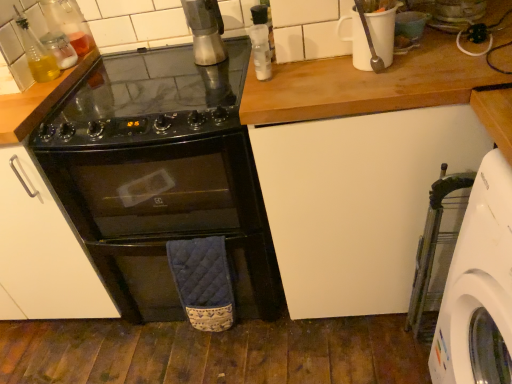
Describe the element at coordinates (205, 31) in the screenshot. I see `metallic silver grinder at upper center` at that location.

Describe the element at coordinates (356, 202) in the screenshot. I see `white matte cabinet at center` at that location.

What is the approximate width of black glass gas stove at center?

63.66 centimeters.

I want to click on transparent plastic bottle at upper center, acting as the third bottle starting from the left, so click(x=260, y=42).

This screenshot has width=512, height=384. Describe the element at coordinates (435, 252) in the screenshot. I see `white plastic washing machine at lower right` at that location.

Where is `metallic silver grinder at upper center`? This screenshot has height=384, width=512. metallic silver grinder at upper center is located at coordinates (205, 31).

Looking at this image, from the image's perspective, is white matte cabinet at center below metallic silver grinder at upper center?

Yes.

Based on the photo, do you think white matte cabinet at center is within metallic silver grinder at upper center, or outside of it?

white matte cabinet at center lies outside metallic silver grinder at upper center.

Which of these two, white matte cabinet at center or metallic silver grinder at upper center, is wider?

With larger width is white matte cabinet at center.

Considering the relative sizes of white matte cabinet at center and transparent plastic bottle at upper center, acting as the third bottle starting from the left, in the image provided, is white matte cabinet at center taller than transparent plastic bottle at upper center, acting as the third bottle starting from the left,?

Indeed, white matte cabinet at center has a greater height compared to transparent plastic bottle at upper center, acting as the third bottle starting from the left.

Is white matte cabinet at center directly adjacent to transparent plastic bottle at upper center, arranged as the first bottle when viewed from the right?

white matte cabinet at center is not next to transparent plastic bottle at upper center, arranged as the first bottle when viewed from the right, and they're not touching.

Is white matte cabinet at center oriented away from transparent plastic bottle at upper center, acting as the third bottle starting from the left?

That's not correct — white matte cabinet at center is not looking away from transparent plastic bottle at upper center, acting as the third bottle starting from the left.

Could you measure the distance between white matte cabinet at center and transparent plastic bottle at upper center, arranged as the first bottle when viewed from the right?

The distance of white matte cabinet at center from transparent plastic bottle at upper center, arranged as the first bottle when viewed from the right, is 17.35 inches.

Between black glass gas stove at center and white plastic washing machine at lower right, which one has more height?

Standing taller between the two is white plastic washing machine at lower right.

Consider the image. Is black glass gas stove at center facing away from white plastic washing machine at lower right?

black glass gas stove at center is not turned away from white plastic washing machine at lower right.

Is black glass gas stove at center next to white plastic washing machine at lower right?

No, black glass gas stove at center is not with white plastic washing machine at lower right.

Is point (63, 48) farther from viewer compared to point (15, 17)?

Yes, it is behind point (15, 17).

Is translucent glass bottle at upper left, positioned as the second bottle in left-to-right order, placed right next to translucent glass bottle at upper left, marked as the first bottle in a left-to-right arrangement?

Yes.

Consider the image. Considering the sizes of translucent glass bottle at upper left, positioned as the 2th bottle in right-to-left order, and translucent glass bottle at upper left, marked as the first bottle in a left-to-right arrangement, in the image, is translucent glass bottle at upper left, positioned as the 2th bottle in right-to-left order, wider or thinner than translucent glass bottle at upper left, marked as the first bottle in a left-to-right arrangement,?

Considering their sizes, translucent glass bottle at upper left, positioned as the 2th bottle in right-to-left order, looks broader than translucent glass bottle at upper left, marked as the first bottle in a left-to-right arrangement.

Which bottle is the 1st one when counting from the front of the translucent glass bottle at upper left, positioned as the second bottle in left-to-right order? Please provide its 2D coordinates.

[(36, 52)]

Considering the relative sizes of translucent glass bottle at upper left, the 3th bottle from the right, and white matte cabinet at center in the image provided, is translucent glass bottle at upper left, the 3th bottle from the right, wider than white matte cabinet at center?

Incorrect, the width of translucent glass bottle at upper left, the 3th bottle from the right, does not surpass that of white matte cabinet at center.

How far apart are translucent glass bottle at upper left, the 3th bottle from the right, and white matte cabinet at center?

1.01 meters.

Does point (26, 21) come farther from viewer compared to point (362, 175)?

Yes, it is.

Considering the positions of objects translucent glass bottle at upper left, marked as the first bottle in a left-to-right arrangement, and white matte cabinet at center in the image provided, who is more to the right, translucent glass bottle at upper left, marked as the first bottle in a left-to-right arrangement, or white matte cabinet at center?

white matte cabinet at center is more to the right.

Does point (433, 238) come in front of point (195, 27)?

Yes, point (433, 238) is in front of point (195, 27).

Considering the relative sizes of white plastic washing machine at lower right and metallic silver grinder at upper center in the image provided, is white plastic washing machine at lower right thinner than metallic silver grinder at upper center?

In fact, white plastic washing machine at lower right might be wider than metallic silver grinder at upper center.

Which is more to the left, white plastic washing machine at lower right or metallic silver grinder at upper center?

From the viewer's perspective, metallic silver grinder at upper center appears more on the left side.

Considering the relative sizes of black glass gas stove at center and translucent glass bottle at upper left, the 3th bottle from the right, in the image provided, is black glass gas stove at center bigger than translucent glass bottle at upper left, the 3th bottle from the right,?

Yes.

Which of these two, black glass gas stove at center or translucent glass bottle at upper left, the 3th bottle from the right, stands shorter?

Standing shorter between the two is black glass gas stove at center.

From a real-world perspective, between black glass gas stove at center and translucent glass bottle at upper left, marked as the first bottle in a left-to-right arrangement, who is vertically higher?

translucent glass bottle at upper left, marked as the first bottle in a left-to-right arrangement, is physically above.

From the image's perspective, is black glass gas stove at center located beneath translucent glass bottle at upper left, marked as the first bottle in a left-to-right arrangement?

Indeed, from the image's perspective, black glass gas stove at center is shown beneath translucent glass bottle at upper left, marked as the first bottle in a left-to-right arrangement.

Image resolution: width=512 pixels, height=384 pixels. Find the location of `cabinetry located below the metallic silver grinder at upper center (from the image's perspective)`. cabinetry located below the metallic silver grinder at upper center (from the image's perspective) is located at coordinates (356, 202).

Where is `bottle that is the 1st one when counting backward from the white matte cabinet at center`? bottle that is the 1st one when counting backward from the white matte cabinet at center is located at coordinates (260, 42).

Looking at the image, which one is located further to black glass oven at center, transparent plastic bottle at upper center, acting as the third bottle starting from the left, or white plastic washing machine at lower right?

white plastic washing machine at lower right.

From the image, which object appears to be nearer to black glass gas stove at center, translucent glass bottle at upper left, positioned as the 2th bottle in right-to-left order, or black glass oven at center?

black glass oven at center is closer to black glass gas stove at center.

Considering their positions, is black glass oven at center positioned further to white matte cabinet at center than transparent plastic bottle at upper center, arranged as the first bottle when viewed from the right?

The object further to white matte cabinet at center is transparent plastic bottle at upper center, arranged as the first bottle when viewed from the right.

Which object lies nearer to the anchor point transparent plastic bottle at upper center, acting as the third bottle starting from the left, black glass gas stove at center or metallic silver grinder at upper center?

metallic silver grinder at upper center is positioned closer to the anchor transparent plastic bottle at upper center, acting as the third bottle starting from the left.

Which object lies further to the anchor point black glass gas stove at center, transparent plastic bottle at upper center, acting as the third bottle starting from the left, or white matte cabinet at center?

Among the two, white matte cabinet at center is located further to black glass gas stove at center.

From the image, which object appears to be farther from black glass gas stove at center, white matte cabinet at center or translucent glass bottle at upper left, the 3th bottle from the right?

The object further to black glass gas stove at center is white matte cabinet at center.

Looking at the image, which one is located closer to translucent glass bottle at upper left, the 3th bottle from the right, white plastic washing machine at lower right or transparent plastic bottle at upper center, arranged as the first bottle when viewed from the right?

transparent plastic bottle at upper center, arranged as the first bottle when viewed from the right, lies closer to translucent glass bottle at upper left, the 3th bottle from the right, than the other object.

From the image, which object appears to be nearer to white plastic washing machine at lower right, translucent glass bottle at upper left, marked as the first bottle in a left-to-right arrangement, or white matte cabinet at center?

Based on the image, white matte cabinet at center appears to be nearer to white plastic washing machine at lower right.

At what (x,y) coordinates should I click in order to perform the action: click on gas stove that lies between transparent plastic bottle at upper center, arranged as the first bottle when viewed from the right, and black glass oven at center from top to bottom. Please return your answer as a coordinate pair (x, y). The image size is (512, 384). Looking at the image, I should click on (147, 99).

Where is `bottle between black glass oven at center and white plastic washing machine at lower right in the horizontal direction`? The height and width of the screenshot is (384, 512). bottle between black glass oven at center and white plastic washing machine at lower right in the horizontal direction is located at coordinates (260, 42).

At what (x,y) coordinates should I click in order to perform the action: click on bottle situated between black glass gas stove at center and white matte cabinet at center from left to right. Please return your answer as a coordinate pair (x, y). The height and width of the screenshot is (384, 512). Looking at the image, I should click on (260, 42).

The width and height of the screenshot is (512, 384). What are the coordinates of `cabinetry between translucent glass bottle at upper left, marked as the first bottle in a left-to-right arrangement, and white plastic washing machine at lower right from left to right` in the screenshot? It's located at (356, 202).